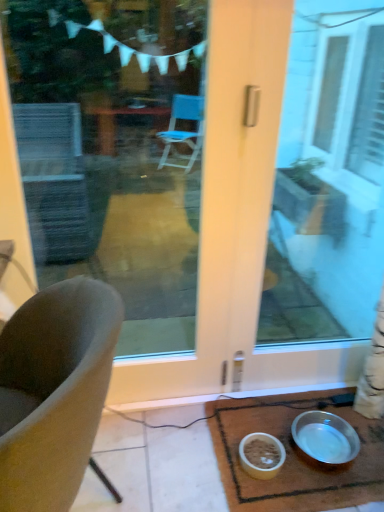
In order to click on vacant area to the right of silver metallic bowl at lower right, arranged as the 1th bowl when viewed from the right in this screenshot , I will do `click(367, 446)`.